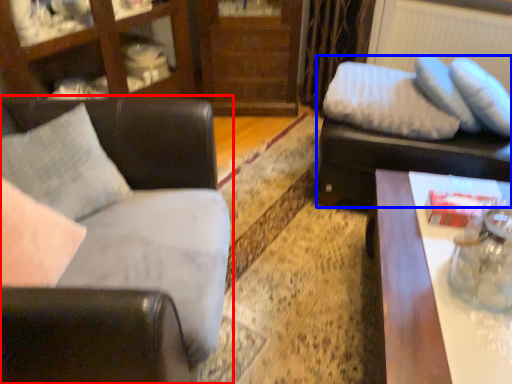
Question: Which of the following is the closest to the observer, studio couch (highlighted by a red box) or swivel chair (highlighted by a blue box)?

Choices:
 (A) studio couch
 (B) swivel chair

Answer: (A)